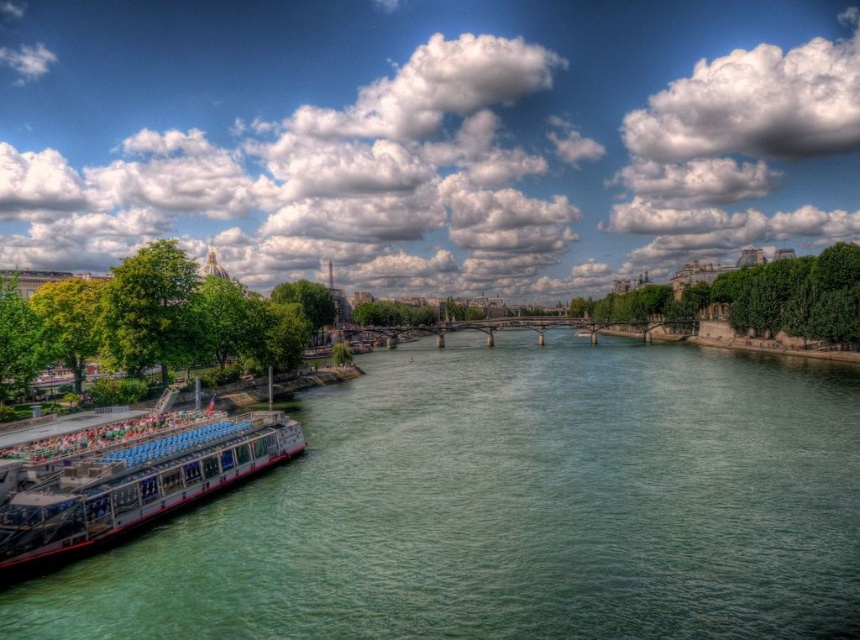
Does green smooth water at lower left appear over white glossy boat at lower left?

Indeed, green smooth water at lower left is positioned over white glossy boat at lower left.

Which of these two, green smooth water at lower left or white glossy boat at lower left, stands taller?

With more height is green smooth water at lower left.

The width and height of the screenshot is (860, 640). I want to click on green smooth water at lower left, so click(513, 508).